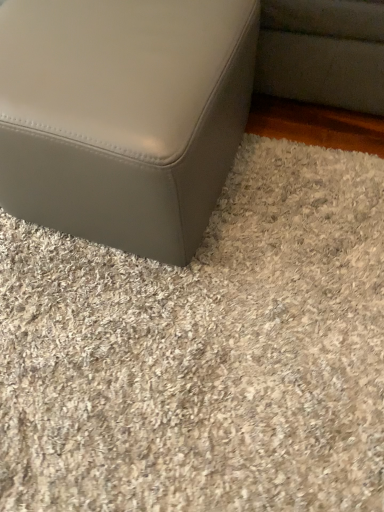
What do you see at coordinates (123, 116) in the screenshot? I see `matte gray ottoman at lower left` at bounding box center [123, 116].

Measure the distance between matte gray ottoman at lower left and camera.

matte gray ottoman at lower left is 27.05 inches from camera.

The image size is (384, 512). I want to click on matte gray ottoman at lower left, so pos(123,116).

Describe the element at coordinates (204, 352) in the screenshot. I see `matte gray ottoman at lower left` at that location.

Where is `matte gray ottoman at lower left`? matte gray ottoman at lower left is located at coordinates (204, 352).

The width and height of the screenshot is (384, 512). I want to click on matte gray ottoman at lower left, so click(x=123, y=116).

Is matte gray ottoman at lower left at the left side of matte gray ottoman at lower left?

Indeed, matte gray ottoman at lower left is positioned on the left side of matte gray ottoman at lower left.

Considering the relative positions of matte gray ottoman at lower left and matte gray ottoman at lower left in the image provided, is matte gray ottoman at lower left behind matte gray ottoman at lower left?

No, matte gray ottoman at lower left is in front of matte gray ottoman at lower left.

Which is in front, point (162, 140) or point (212, 336)?

The point (162, 140) is closer to the camera.

From the image's perspective, which is below, matte gray ottoman at lower left or matte gray ottoman at lower left?

matte gray ottoman at lower left, from the image's perspective.

From a real-world perspective, is matte gray ottoman at lower left over matte gray ottoman at lower left?

Yes, from a real-world perspective, matte gray ottoman at lower left is over matte gray ottoman at lower left

From the picture: Can you confirm if matte gray ottoman at lower left is thinner than matte gray ottoman at lower left?

Yes, matte gray ottoman at lower left is thinner than matte gray ottoman at lower left.

Considering the relative sizes of matte gray ottoman at lower left and matte gray ottoman at lower left in the image provided, is matte gray ottoman at lower left shorter than matte gray ottoman at lower left?

Incorrect, the height of matte gray ottoman at lower left does not fall short of that of matte gray ottoman at lower left.

Who is smaller, matte gray ottoman at lower left or matte gray ottoman at lower left?

matte gray ottoman at lower left.

Do you think matte gray ottoman at lower left is within matte gray ottoman at lower left, or outside of it?

matte gray ottoman at lower left lies outside matte gray ottoman at lower left.

Is matte gray ottoman at lower left with matte gray ottoman at lower left?

No, matte gray ottoman at lower left is not beside matte gray ottoman at lower left.

Is matte gray ottoman at lower left turned away from matte gray ottoman at lower left?

No, matte gray ottoman at lower left's orientation is not away from matte gray ottoman at lower left.

The image size is (384, 512). Find the location of `furniture on the left of matte gray ottoman at lower left`. furniture on the left of matte gray ottoman at lower left is located at coordinates (123, 116).

Does matte gray ottoman at lower left appear on the left side of matte gray ottoman at lower left?

No.

Is matte gray ottoman at lower left further to camera compared to matte gray ottoman at lower left?

That is True.

Is point (105, 355) closer to camera compared to point (125, 132)?

No, (105, 355) is further to viewer.

From the image's perspective, is matte gray ottoman at lower left located above matte gray ottoman at lower left?

Actually, matte gray ottoman at lower left appears below matte gray ottoman at lower left in the image.

From a real-world perspective, which object rests below the other?

matte gray ottoman at lower left is physically lower.

Does matte gray ottoman at lower left have a greater width compared to matte gray ottoman at lower left?

Correct, the width of matte gray ottoman at lower left exceeds that of matte gray ottoman at lower left.

From their relative heights in the image, would you say matte gray ottoman at lower left is taller or shorter than matte gray ottoman at lower left?

In the image, matte gray ottoman at lower left appears to be shorter than matte gray ottoman at lower left.

Looking at the image, does matte gray ottoman at lower left seem bigger or smaller compared to matte gray ottoman at lower left?

Considering their sizes, matte gray ottoman at lower left takes up less space than matte gray ottoman at lower left.

Is matte gray ottoman at lower left positioned beyond the bounds of matte gray ottoman at lower left?

matte gray ottoman at lower left is positioned outside matte gray ottoman at lower left.

Is matte gray ottoman at lower left far away from matte gray ottoman at lower left?

No, there isn't a large distance between matte gray ottoman at lower left and matte gray ottoman at lower left.

Is matte gray ottoman at lower left facing towards matte gray ottoman at lower left?

No, matte gray ottoman at lower left is not turned towards matte gray ottoman at lower left.

Can you tell me how much matte gray ottoman at lower left and matte gray ottoman at lower left differ in facing direction?

There is a 4.2-degree angle between the facing directions of matte gray ottoman at lower left and matte gray ottoman at lower left.

How distant is matte gray ottoman at lower left from matte gray ottoman at lower left?

31.98 centimeters.

Locate an element on the screen. The image size is (384, 512). furniture that appears on the left of matte gray ottoman at lower left is located at coordinates (123, 116).

You are a GUI agent. You are given a task and a screenshot of the screen. Output one action in this format:
    pyautogui.click(x=<x>, y=<y>)
    Task: Click on the furniture that appears above the matte gray ottoman at lower left (from the image's perspective)
    
    Given the screenshot: What is the action you would take?
    pyautogui.click(x=123, y=116)

The height and width of the screenshot is (512, 384). Find the location of `furniture on the left of the matte gray ottoman at lower left`. furniture on the left of the matte gray ottoman at lower left is located at coordinates (123, 116).